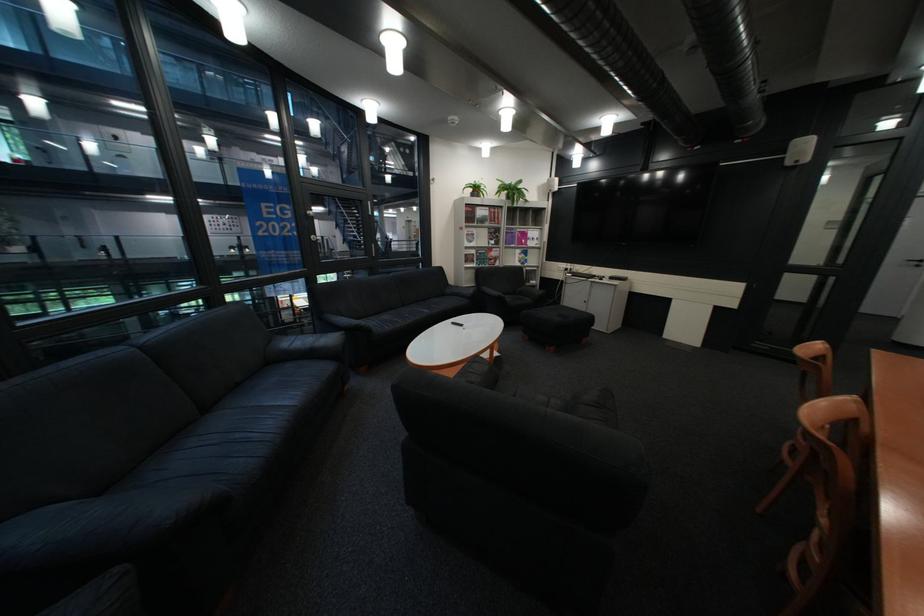
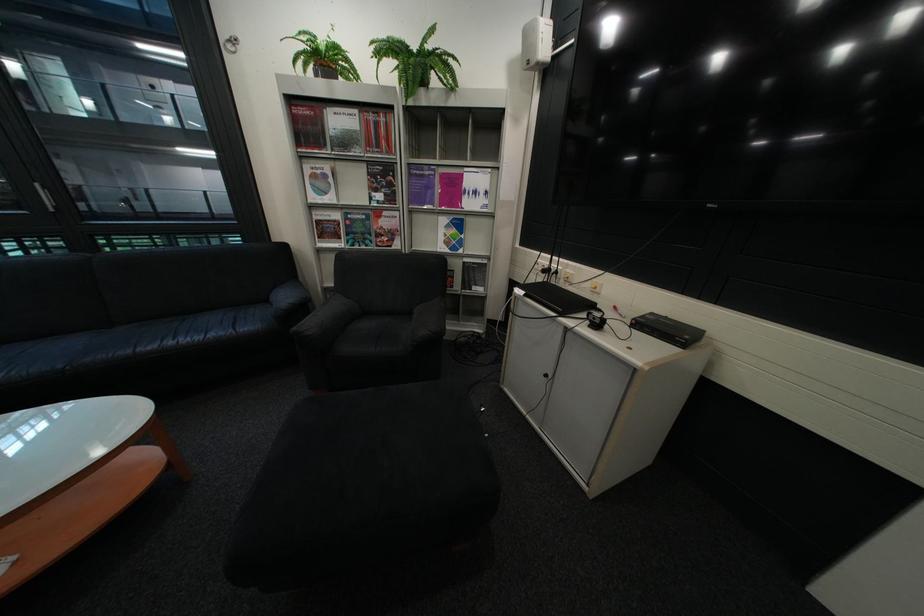
Find the pixel in the second image that matches [488,196] in the first image.

(333, 78)